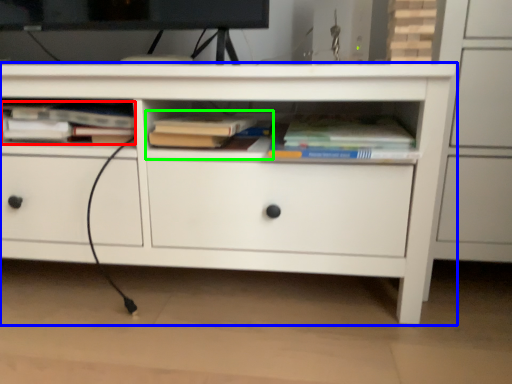
Question: Which object is the farthest from book (highlighted by a red box)? Choose among these: chest of drawers (highlighted by a blue box) or book (highlighted by a green box).

Choices:
 (A) chest of drawers
 (B) book

Answer: (A)